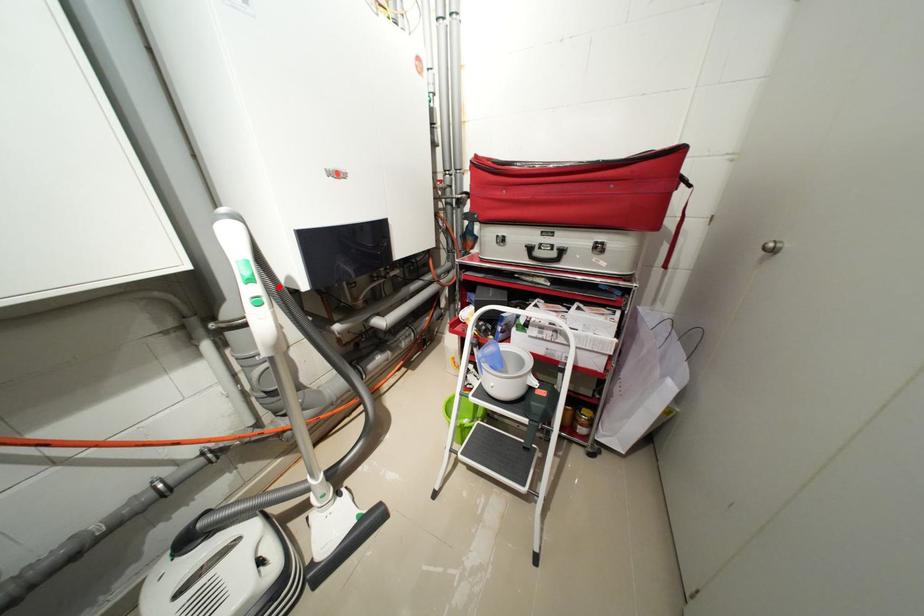
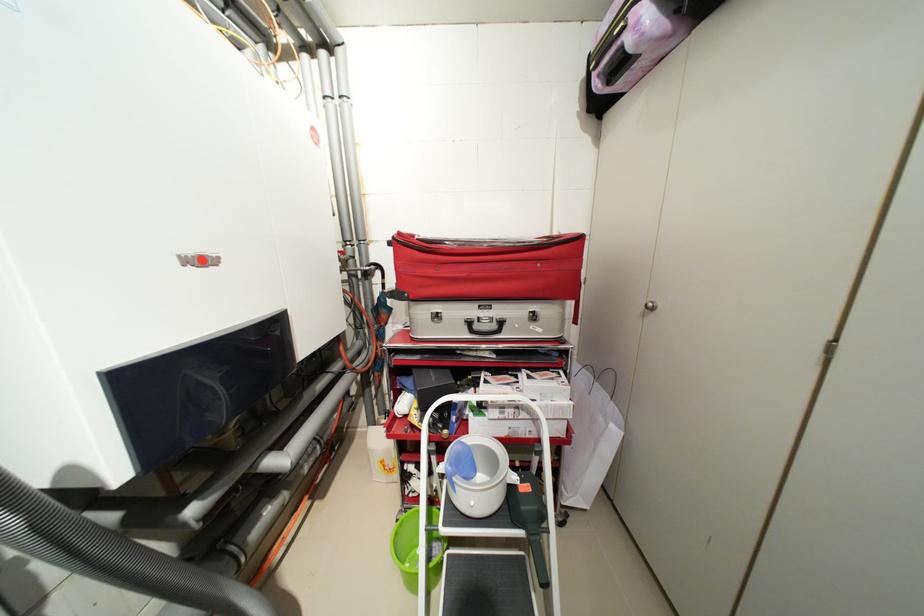
Question: I am providing you with two images of the same scene from different viewpoints. In image1, a red point is highlighted. Considering the same 3D point in image2, which of the following is correct?

Choices:
 (A) It is closer
 (B) It is farther

Answer: (A)